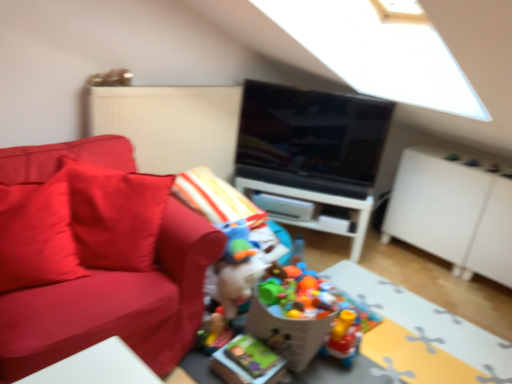
I want to click on empty space that is to the right of white plastic table at center, the 1th table when ordered from top to bottom, so click(x=390, y=261).